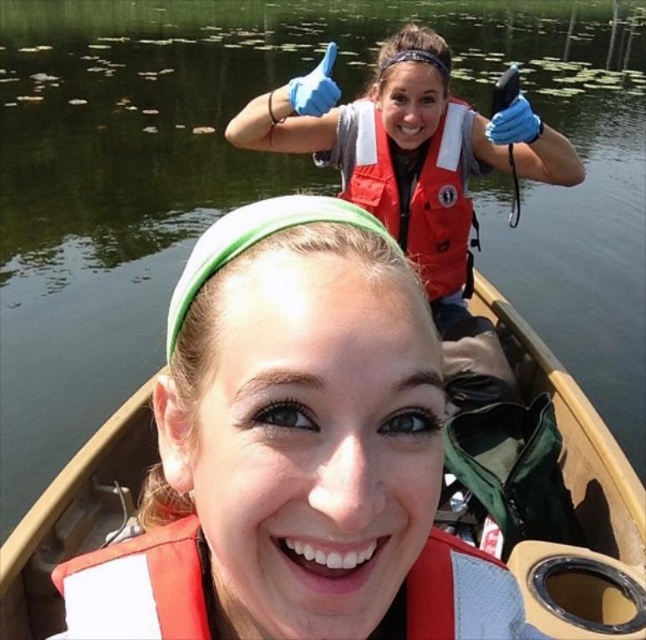
Based on the photo, which is more to the right, matte red life jacket at lower center or red matte life jacket at upper center?

red matte life jacket at upper center is more to the right.

Is point (185, 545) closer to camera compared to point (364, 128)?

Yes.

You are a GUI agent. You are given a task and a screenshot of the screen. Output one action in this format:
    pyautogui.click(x=<x>, y=<y>)
    Task: Click on the matte red life jacket at lower center
    
    Given the screenshot: What is the action you would take?
    pyautogui.click(x=140, y=586)

Does brown wood boat at center appear on the right side of red matte life jacket at upper center?

Incorrect, brown wood boat at center is not on the right side of red matte life jacket at upper center.

Does brown wood boat at center have a larger size compared to red matte life jacket at upper center?

Actually, brown wood boat at center might be smaller than red matte life jacket at upper center.

Find the location of `brown wood boat at center`. brown wood boat at center is located at coordinates (286, 461).

You are a GUI agent. You are given a task and a screenshot of the screen. Output one action in this format:
    pyautogui.click(x=<x>, y=<y>)
    Task: Click on the brown wood boat at center
    The height and width of the screenshot is (640, 646).
    Given the screenshot: What is the action you would take?
    pyautogui.click(x=286, y=461)

Based on the photo, does brown wood boat at center lie behind matte red life jacket at lower center?

Yes, it is behind matte red life jacket at lower center.

Which of these two, brown wood boat at center or matte red life jacket at lower center, stands taller?

brown wood boat at center is taller.

Locate an element on the screen. brown wood boat at center is located at coordinates (286, 461).

The image size is (646, 640). I want to click on brown wood boat at center, so click(286, 461).